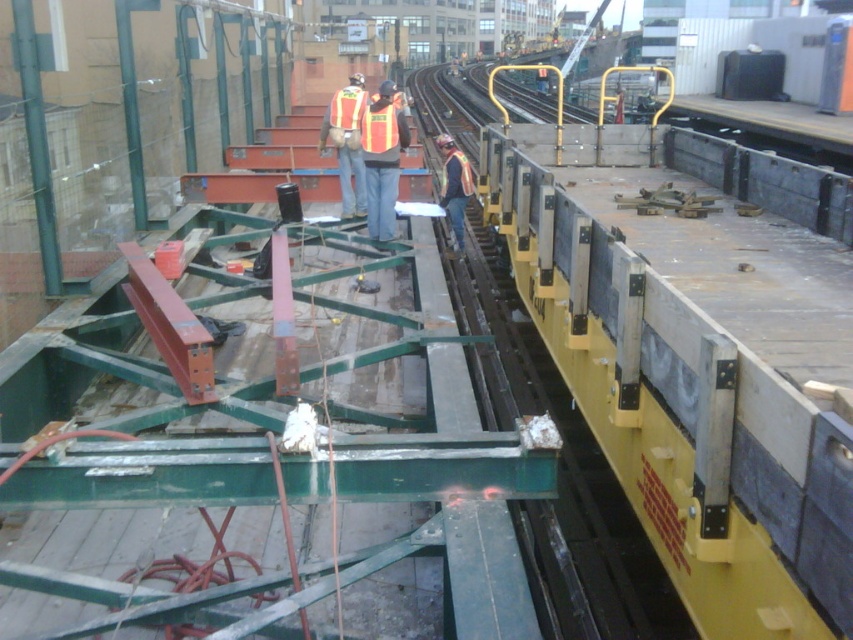
Is point (808, 522) positioned before point (363, 115)?

Yes.

Who is more forward, (831, 236) or (387, 109)?

Point (831, 236) is more forward.

At what (x,y) coordinates should I click in order to perform the action: click on yellow painted steel train car at center. Please return your answer as a coordinate pair (x, y). Looking at the image, I should click on (688, 355).

Identify the location of reflective safety vest at center. (456, 186).

Is reflective safety vest at center positioned at the back of reflective fabric safety vest at center?

That is True.

Is point (463, 218) positioned behind point (373, 138)?

That is True.

In order to click on reflective safety vest at center in this screenshot , I will do point(456,186).

Does yellow painted steel train car at center have a smaller size compared to reflective safety vest at center?

Actually, yellow painted steel train car at center might be larger than reflective safety vest at center.

Consider the image. Does yellow painted steel train car at center appear on the right side of reflective safety vest at center?

Indeed, yellow painted steel train car at center is positioned on the right side of reflective safety vest at center.

Find the location of a particular element. The height and width of the screenshot is (640, 853). yellow painted steel train car at center is located at coordinates (688, 355).